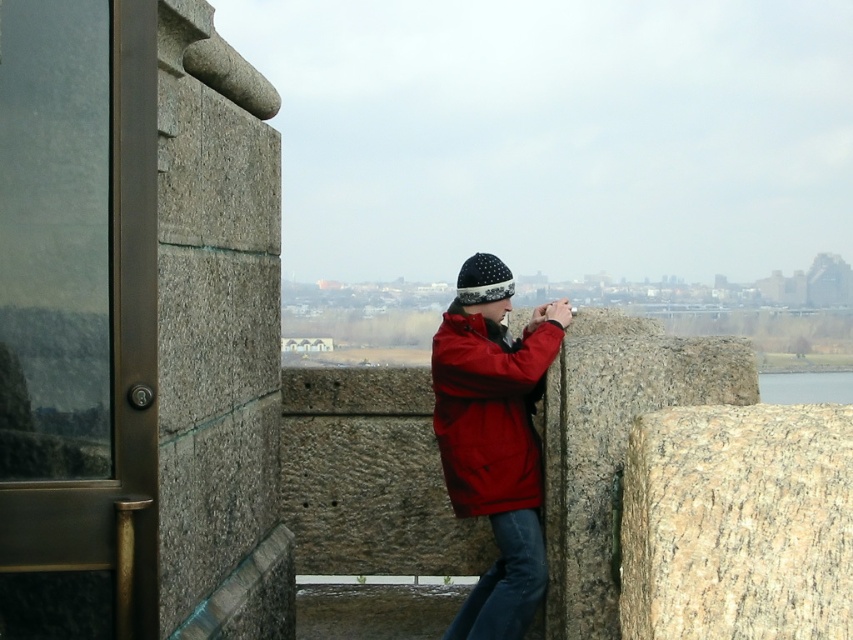
Question: Does matte red jacket at center have a smaller size compared to denim at center?

Choices:
 (A) yes
 (B) no

Answer: (B)

Question: Which point is closer to the camera?

Choices:
 (A) (526, 429)
 (B) (543, 556)

Answer: (B)

Question: Can you confirm if matte red jacket at center is bigger than denim at center?

Choices:
 (A) yes
 (B) no

Answer: (A)

Question: Among these objects, which one is nearest to the camera?

Choices:
 (A) denim at center
 (B) matte red jacket at center

Answer: (B)

Question: Does matte red jacket at center appear over denim at center?

Choices:
 (A) yes
 (B) no

Answer: (A)